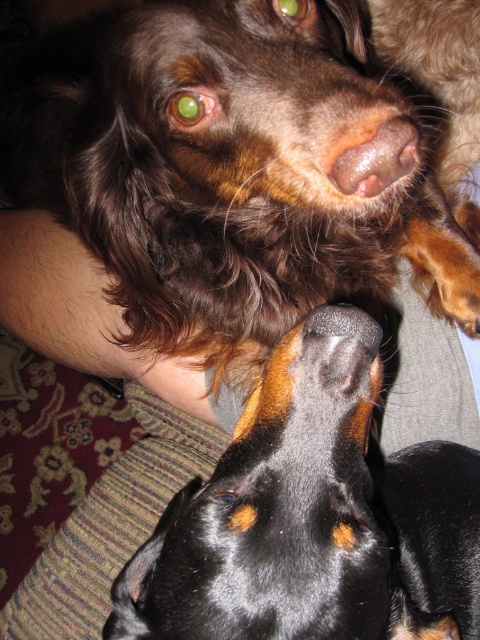
Can you confirm if brown shiny coat at upper center is shorter than brown matte nose at center?

No.

Does brown shiny coat at upper center appear on the right side of brown matte nose at center?

No, brown shiny coat at upper center is not to the right of brown matte nose at center.

At what (x,y) coordinates should I click in order to perform the action: click on brown shiny coat at upper center. Please return your answer as a coordinate pair (x, y). This screenshot has height=640, width=480. Looking at the image, I should click on click(241, 196).

Between black glossy dog at center and brown matte nose at center, which one appears on the left side from the viewer's perspective?

From the viewer's perspective, black glossy dog at center appears more on the left side.

Does black glossy dog at center appear on the left side of brown matte nose at center?

Indeed, black glossy dog at center is positioned on the left side of brown matte nose at center.

Which is behind, point (445, 477) or point (400, 132)?

The point (445, 477) is behind.

The width and height of the screenshot is (480, 640). Find the location of `black glossy dog at center`. black glossy dog at center is located at coordinates (312, 516).

Can you confirm if brown shiny coat at upper center is bigger than black glossy dog at center?

Indeed, brown shiny coat at upper center has a larger size compared to black glossy dog at center.

Can you confirm if brown shiny coat at upper center is smaller than black glossy dog at center?

Actually, brown shiny coat at upper center might be larger than black glossy dog at center.

Where is `brown shiny coat at upper center`? This screenshot has height=640, width=480. brown shiny coat at upper center is located at coordinates (241, 196).